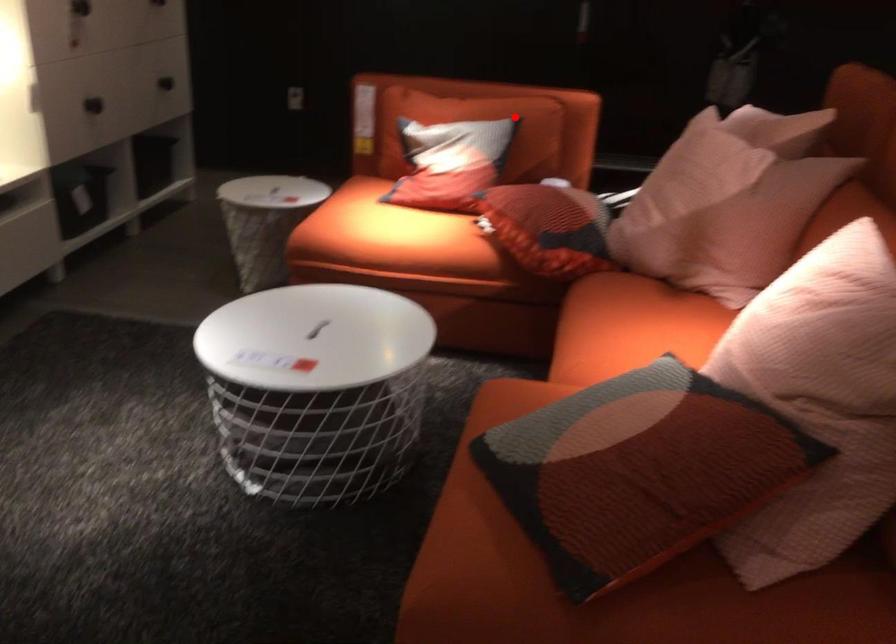
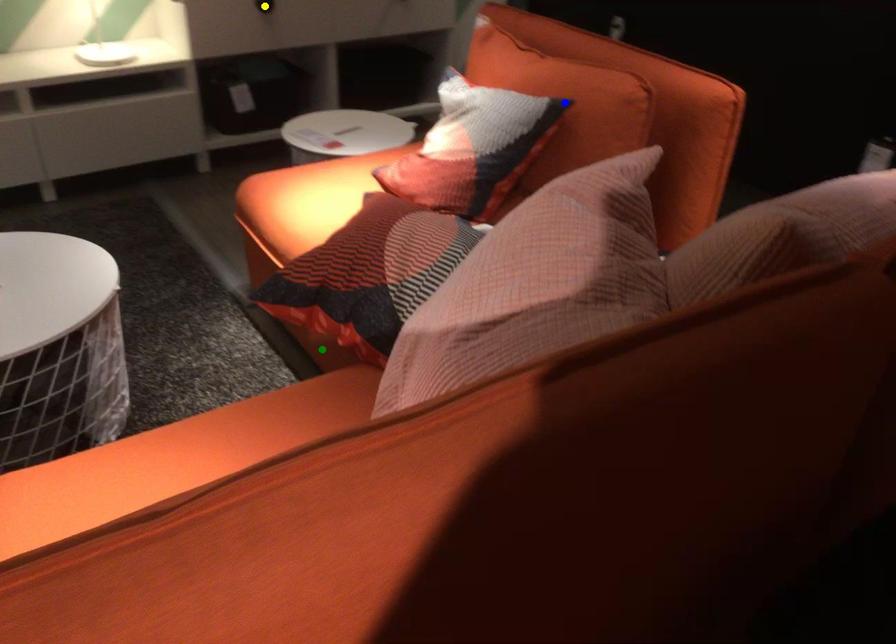
Question: I am providing you with two images of the same scene from different viewpoints. A red point is marked on the first image. You are given multiple points on the second image. Which point in image 2 represents the same 3d spot as the red point in image 1?

Choices:
 (A) green point
 (B) blue point
 (C) yellow point

Answer: (B)